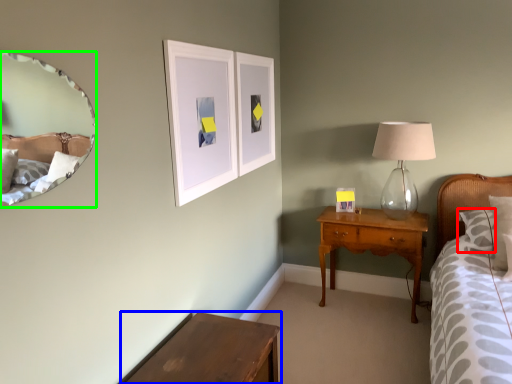
Question: Which object is positioned closest to pillow (highlighted by a red box)? Select from table (highlighted by a blue box) and mirror (highlighted by a green box).

Choices:
 (A) table
 (B) mirror

Answer: (A)